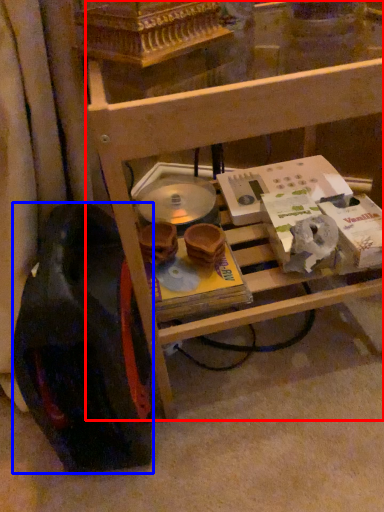
Question: Which of the following is the farthest to the observer, furniture (highlighted by a red box) or wheel (highlighted by a blue box)?

Choices:
 (A) furniture
 (B) wheel

Answer: (B)